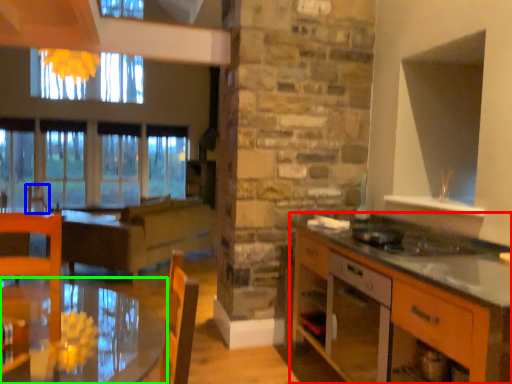
Question: Which is nearer to the cabinetry (highlighted by a red box)? armchair (highlighted by a blue box) or table (highlighted by a green box).

Choices:
 (A) armchair
 (B) table

Answer: (B)